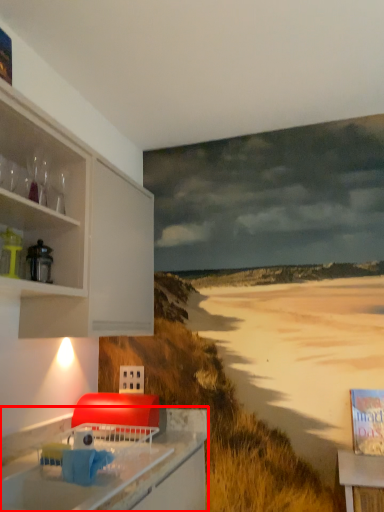
Question: From the image's perspective, considering the relative positions of countertop (annotated by the red box) and appliance in the image provided, where is countertop (annotated by the red box) located with respect to the staircase?

Choices:
 (A) below
 (B) above

Answer: (A)